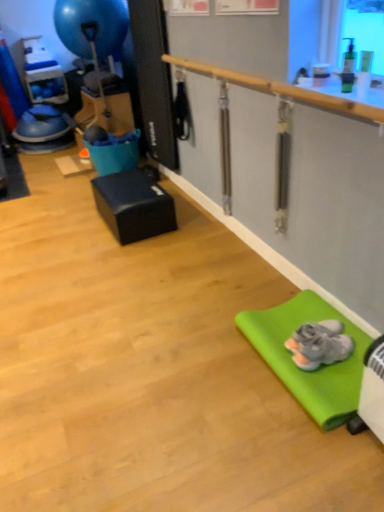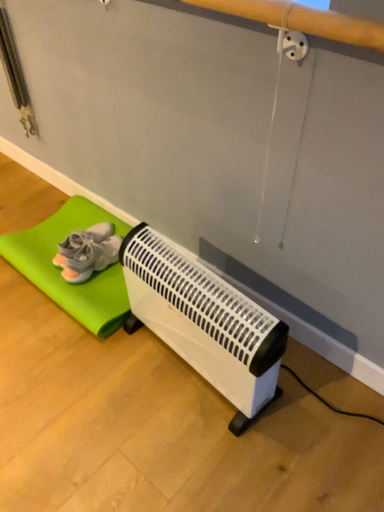
Question: Which way did the camera rotate in the video?

Choices:
 (A) rotated upward
 (B) rotated downward

Answer: (B)